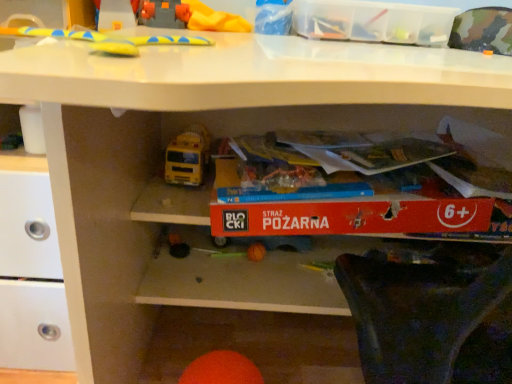
Question: From a real-world perspective, is yellow rubber toy at upper center, which is the 3th toy from bottom to top, physically above transparent plastic storage box at upper center?

Choices:
 (A) yes
 (B) no

Answer: (A)

Question: Can you confirm if yellow rubber toy at upper center, the 3th toy when ordered from front to back, is thinner than transparent plastic storage box at upper center?

Choices:
 (A) yes
 (B) no

Answer: (B)

Question: Is yellow rubber toy at upper center, the 3th toy when ordered from front to back, shorter than transparent plastic storage box at upper center?

Choices:
 (A) yes
 (B) no

Answer: (B)

Question: Is yellow rubber toy at upper center, the 3th toy when ordered from front to back, looking in the opposite direction of transparent plastic storage box at upper center?

Choices:
 (A) no
 (B) yes

Answer: (A)

Question: Is yellow rubber toy at upper center, the 3th toy when ordered from front to back, not inside transparent plastic storage box at upper center?

Choices:
 (A) yes
 (B) no

Answer: (A)

Question: From a real-world perspective, is orange matte ball at lower center, the 2th toy viewed from the back, above or below yellow rubber toy at upper center, the 3th toy when ordered from front to back?

Choices:
 (A) above
 (B) below

Answer: (B)

Question: Looking at their shapes, would you say orange matte ball at lower center, the 1th toy when ordered from bottom to top, is wider or thinner than yellow rubber toy at upper center, the 3th toy when ordered from front to back?

Choices:
 (A) thin
 (B) wide

Answer: (A)

Question: In terms of height, does orange matte ball at lower center, the second toy when ordered from front to back, look taller or shorter compared to yellow rubber toy at upper center, the first toy positioned from the top?

Choices:
 (A) tall
 (B) short

Answer: (A)

Question: From the image's perspective, is orange matte ball at lower center, the third toy from the top, located above or below yellow rubber toy at upper center, acting as the 1th toy starting from the back?

Choices:
 (A) below
 (B) above

Answer: (A)

Question: From the image's perspective, relative to yellow rubber toy at upper center, the first toy positioned from the top, is transparent plastic storage box at upper center above or below?

Choices:
 (A) below
 (B) above

Answer: (A)

Question: Is transparent plastic storage box at upper center inside the boundaries of yellow rubber toy at upper center, the first toy positioned from the top, or outside?

Choices:
 (A) outside
 (B) inside

Answer: (A)

Question: Does point (321, 11) appear closer or farther from the camera than point (183, 0)?

Choices:
 (A) closer
 (B) farther

Answer: (A)

Question: In the image, is transparent plastic storage box at upper center positioned in front of or behind yellow rubber toy at upper center, the 3th toy when ordered from front to back?

Choices:
 (A) front
 (B) behind

Answer: (A)

Question: Looking at their shapes, would you say transparent plastic storage box at upper center is wider or thinner than orange matte ball at lower center, the 2th toy viewed from the back?

Choices:
 (A) thin
 (B) wide

Answer: (B)

Question: Would you say transparent plastic storage box at upper center is inside or outside orange matte ball at lower center, the 2th toy viewed from the back?

Choices:
 (A) inside
 (B) outside

Answer: (B)